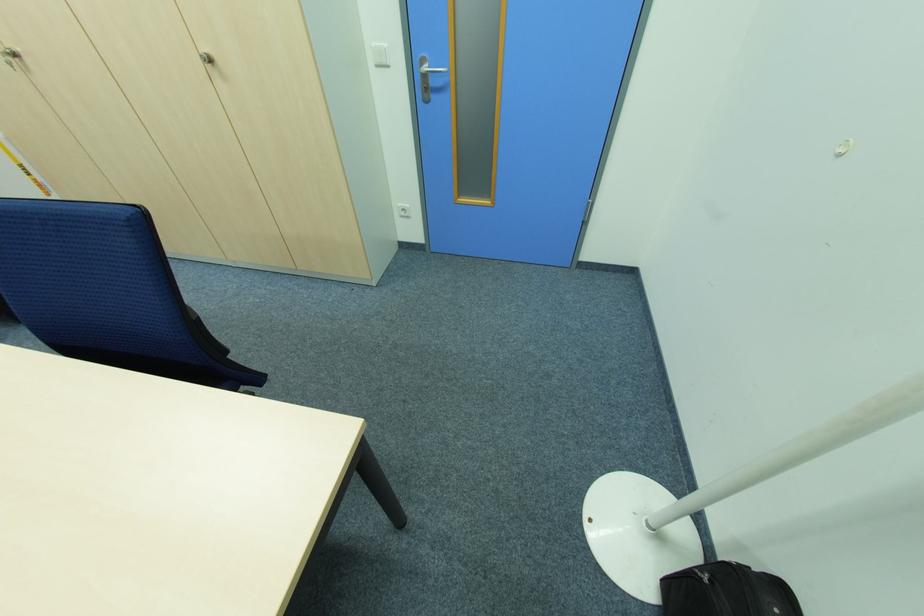
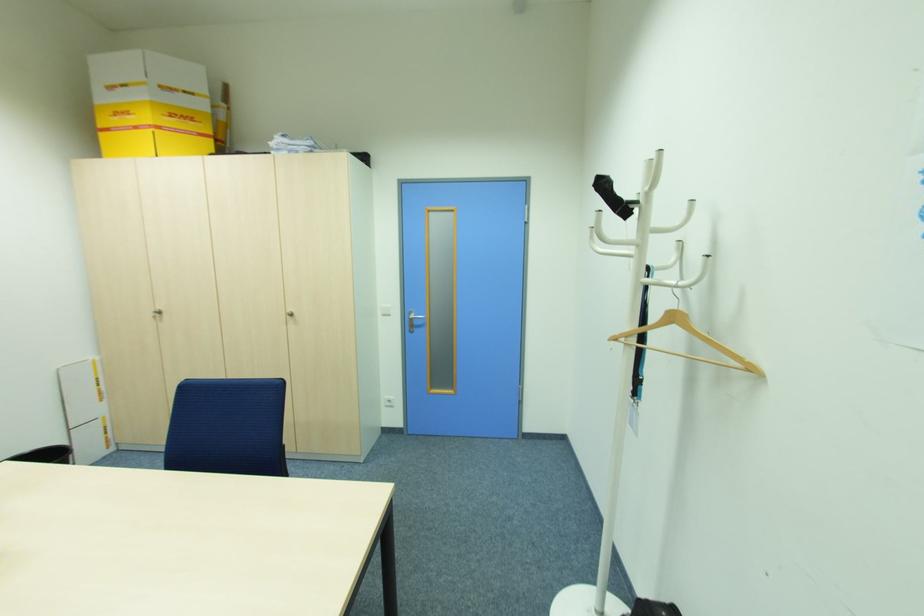
The point at (208,51) is marked in the first image. Where is the corresponding point in the second image?

(292, 310)